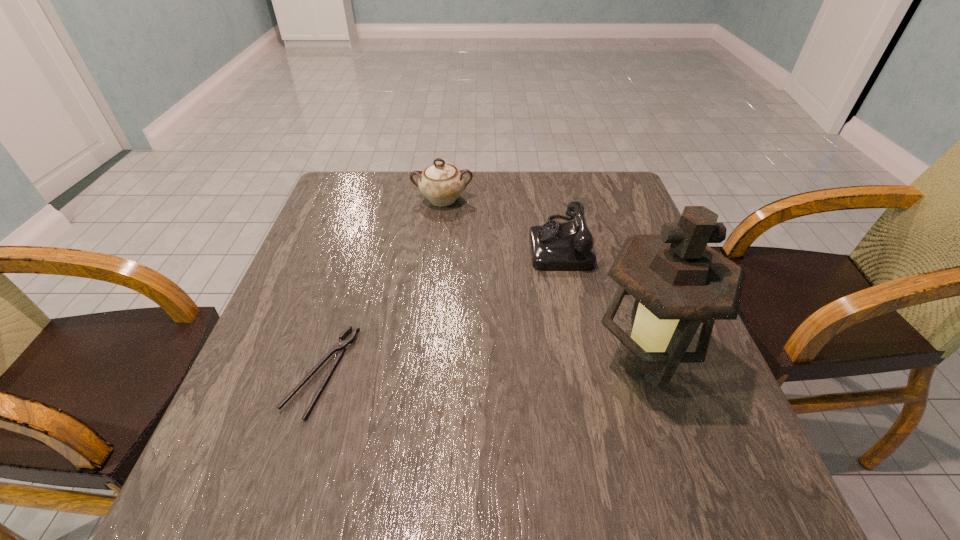
You are a GUI agent. You are given a task and a screenshot of the screen. Output one action in this format:
    pyautogui.click(x=<x>, y=<y>)
    Task: Click on the tallest object
    The height and width of the screenshot is (540, 960).
    Given the screenshot: What is the action you would take?
    pyautogui.click(x=678, y=281)

Identify the location of the third object from right to left. (442, 183).

Identify the location of the farthest object. (442, 183).

Locate an element on the screen. telephone is located at coordinates (554, 246).

Locate an element on the screen. This screenshot has height=540, width=960. the second farthest object is located at coordinates 554,246.

This screenshot has width=960, height=540. In order to click on tongs in this screenshot , I will do `click(340, 346)`.

The width and height of the screenshot is (960, 540). I want to click on the leftmost object, so click(340, 346).

Where is `vacant point located 0.360m on the back of the tallest object`? The height and width of the screenshot is (540, 960). vacant point located 0.360m on the back of the tallest object is located at coordinates (597, 226).

This screenshot has width=960, height=540. I want to click on vacant space situated 0.160m on the front of the third object from right to left, so tap(438, 248).

The width and height of the screenshot is (960, 540). In order to click on vacant region located on the dial of the second shortest object in this screenshot , I will do `click(415, 244)`.